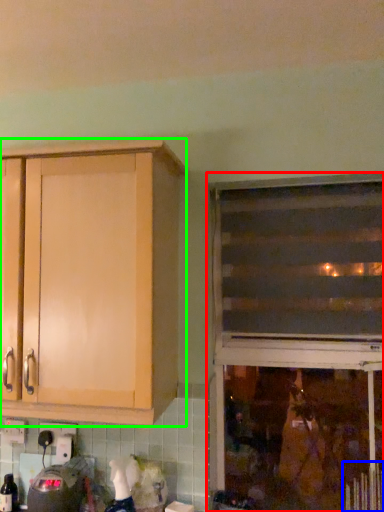
Question: Considering the real-world distances, which object is closest to window (highlighted by a red box)? radiator (highlighted by a blue box) or cabinetry (highlighted by a green box).

Choices:
 (A) radiator
 (B) cabinetry

Answer: (A)